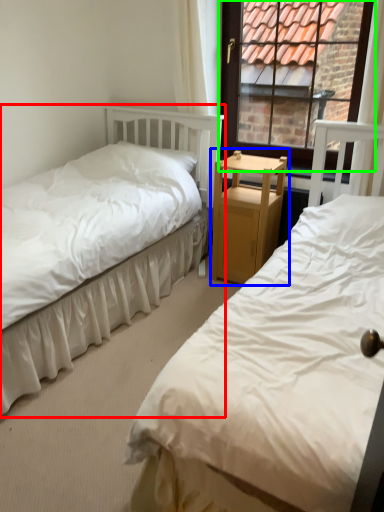
Question: Which object is positioned closest to bed (highlighted by a red box)? Select from nightstand (highlighted by a blue box) and window (highlighted by a green box).

Choices:
 (A) nightstand
 (B) window

Answer: (A)